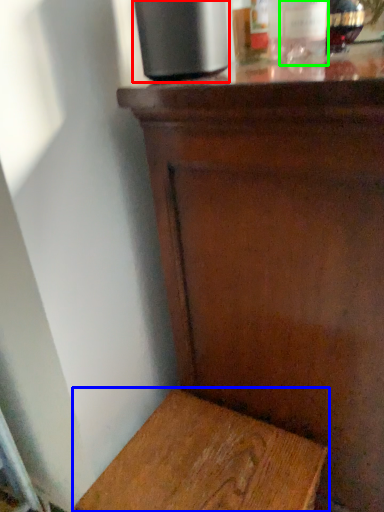
Question: Based on their relative distances, which object is farther from appliance (highlighted by a red box)? Choose from furniture (highlighted by a blue box) and bottle (highlighted by a green box).

Choices:
 (A) furniture
 (B) bottle

Answer: (A)